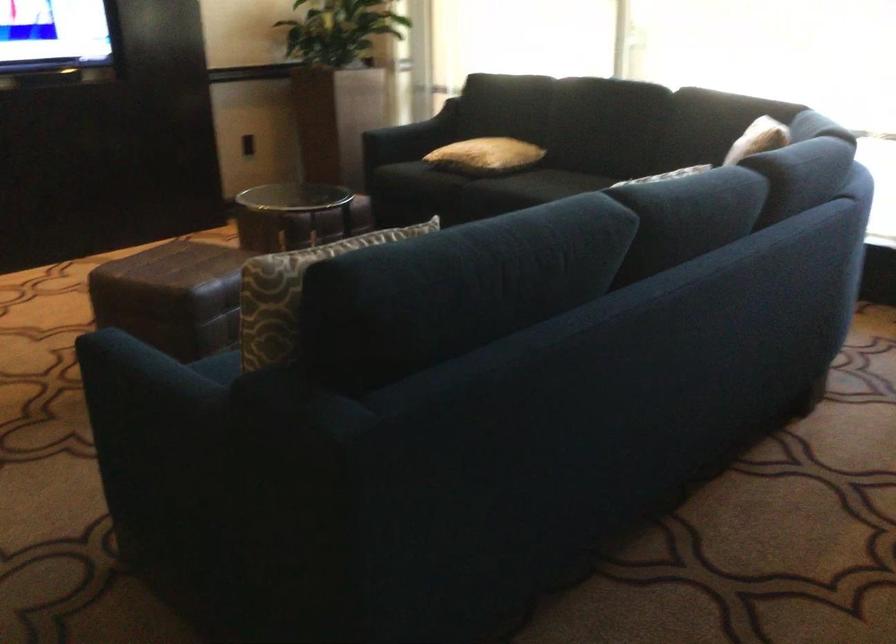
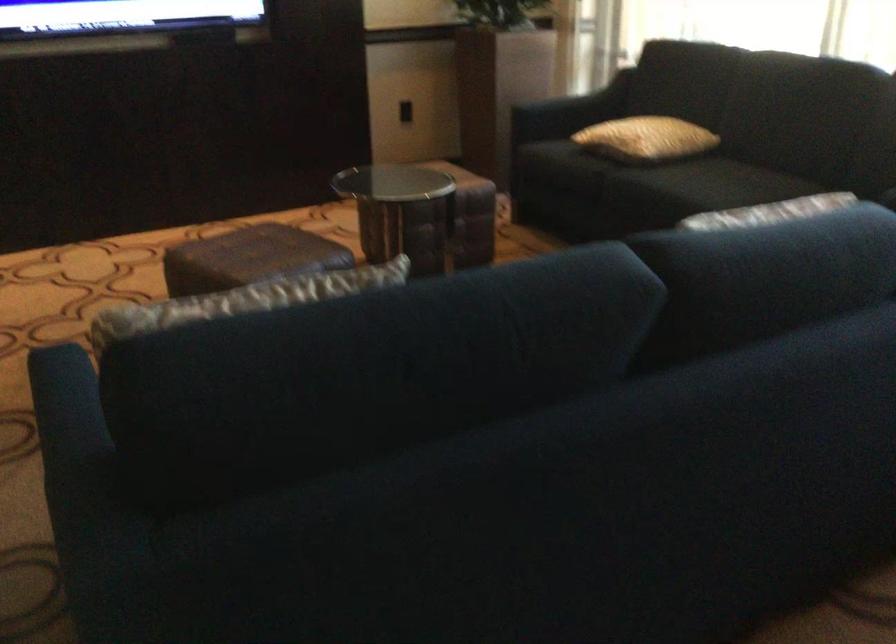
Find the pixel in the second image that matches the point at 492,155 in the first image.

(645, 138)